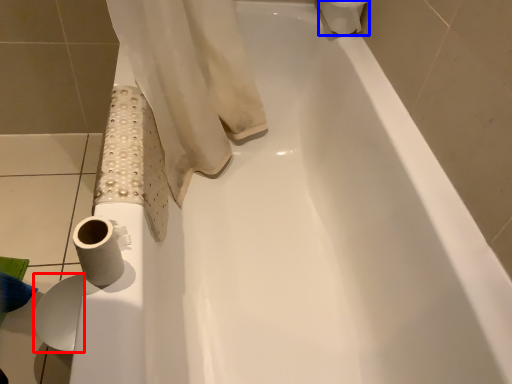
Question: Which object is further to the camera taking this photo, toilet paper (highlighted by a red box) or toilet paper (highlighted by a blue box)?

Choices:
 (A) toilet paper
 (B) toilet paper

Answer: (B)